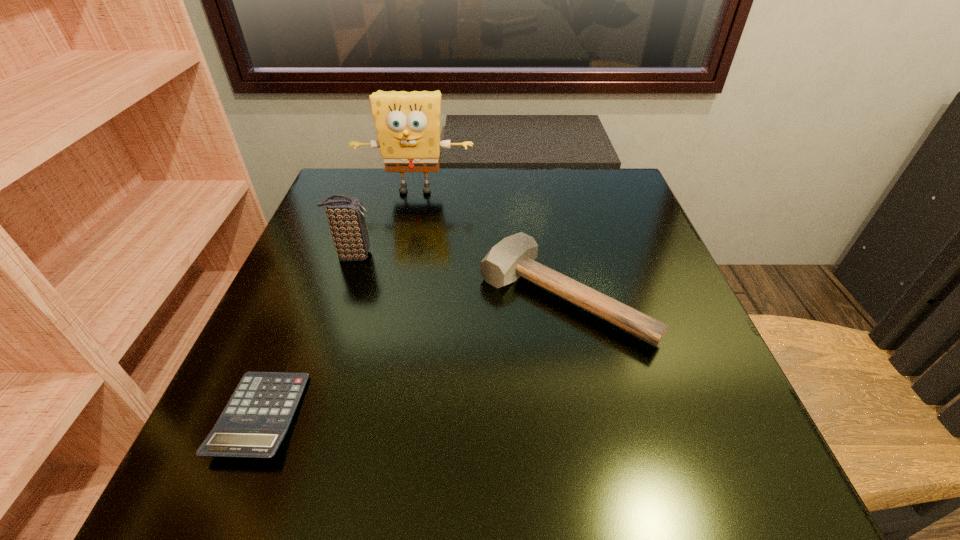
At what (x,y) coordinates should I click in order to perform the action: click on free space between the sponge and the clutch bag. Please return your answer as a coordinate pair (x, y). The image size is (960, 540). Looking at the image, I should click on (384, 222).

This screenshot has height=540, width=960. What are the coordinates of `unoccupied position between the farthest object and the rightmost object` in the screenshot? It's located at (490, 243).

This screenshot has height=540, width=960. Identify the location of vacant space that is in between the sponge and the rightmost object. (490, 243).

This screenshot has width=960, height=540. What are the coordinates of `unoccupied position between the shortest object and the third shortest object` in the screenshot? It's located at (307, 336).

Identify the location of vacant space in between the tallest object and the calculator. (338, 303).

This screenshot has width=960, height=540. What are the coordinates of `free space between the nearest object and the rightmost object` in the screenshot? It's located at (412, 356).

At what (x,y) coordinates should I click in order to perform the action: click on object that can be found as the closest to the tallest object. Please return your answer as a coordinate pair (x, y). This screenshot has height=540, width=960. Looking at the image, I should click on (346, 218).

The height and width of the screenshot is (540, 960). What are the coordinates of `object that ranks as the closest to the sponge` in the screenshot? It's located at (346, 218).

Where is `free spot that satisfies the following two spatial constraints: 1. on the back side of the rightmost object; 2. with the zip open on the clutch bag`? free spot that satisfies the following two spatial constraints: 1. on the back side of the rightmost object; 2. with the zip open on the clutch bag is located at coordinates (555, 255).

Find the location of `free space that satisfies the following two spatial constraints: 1. on the face of the sponge; 2. with the zip open on the second tallest object`. free space that satisfies the following two spatial constraints: 1. on the face of the sponge; 2. with the zip open on the second tallest object is located at coordinates click(x=402, y=255).